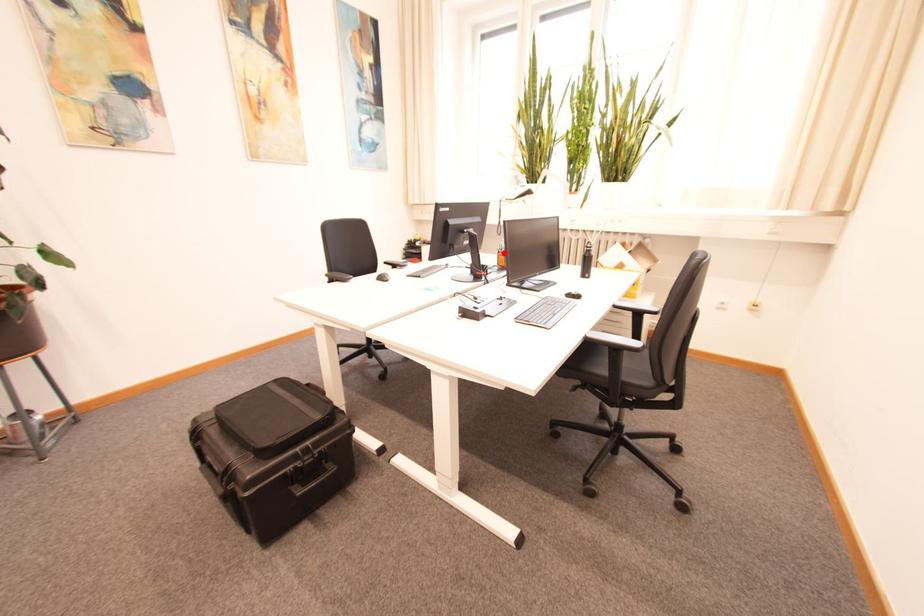
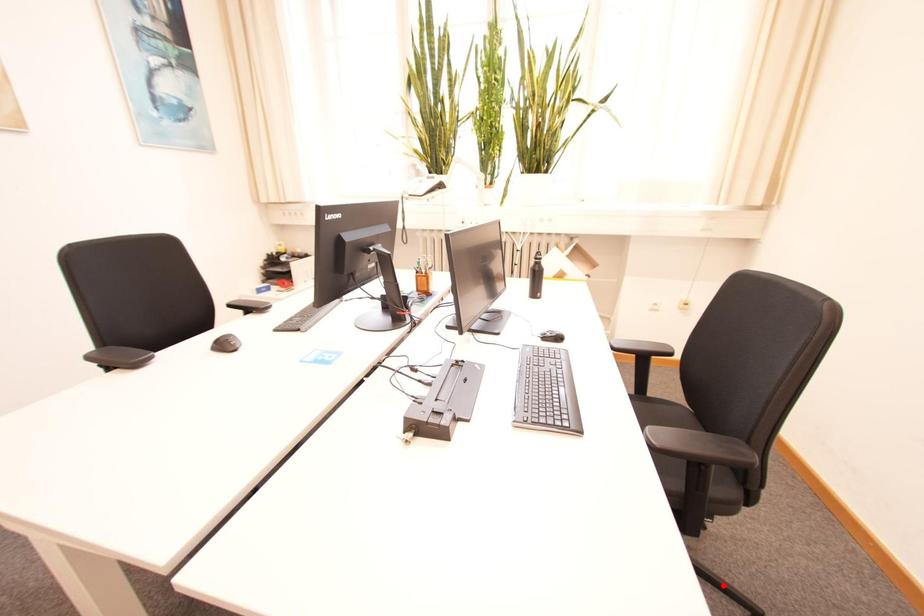
I am providing you with two images of the same scene from different viewpoints. A red point is marked on the first image and another point is marked on the second image. Is the marked point in image1 the same physical position as the marked point in image2?

No